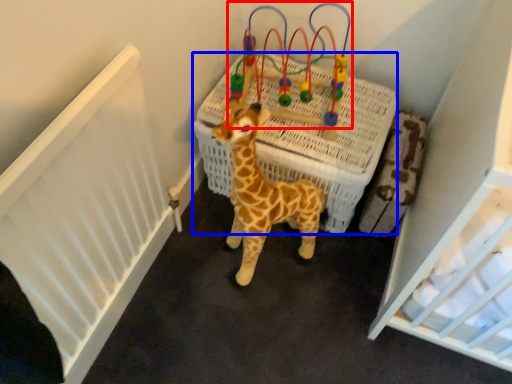
Question: Which object is closer to the camera taking this photo, toy (highlighted by a red box) or infant bed (highlighted by a blue box)?

Choices:
 (A) toy
 (B) infant bed

Answer: (A)